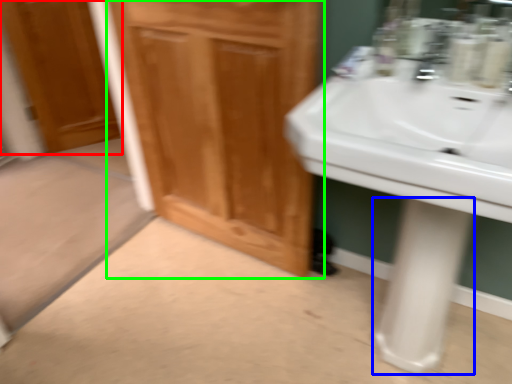
Question: Based on their relative distances, which object is farther from door (highlighted by a red box)? Choose from pillar (highlighted by a blue box) and bathroom cabinet (highlighted by a green box).

Choices:
 (A) pillar
 (B) bathroom cabinet

Answer: (A)